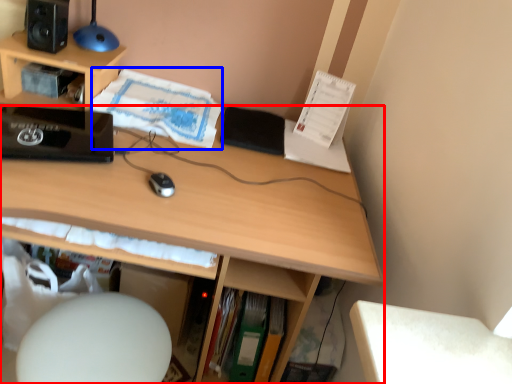
Question: Among these objects, which one is farthest to the camera, desk (highlighted by a red box) or book (highlighted by a blue box)?

Choices:
 (A) desk
 (B) book

Answer: (B)